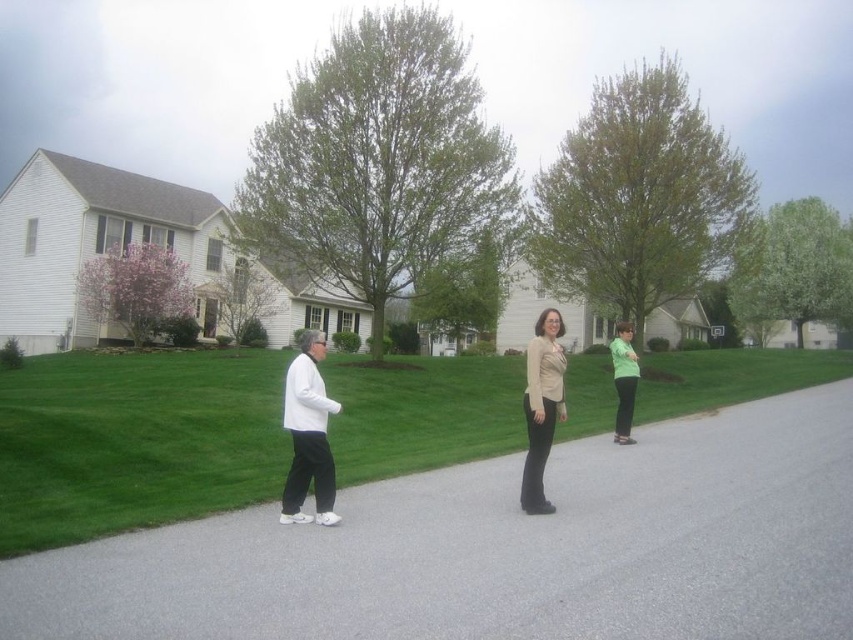
You are a photographer setting up a tripod on the paved path in the suburban scene. You want to position your camera so that both the white matte jacket at center and the matte green sweater at right are visible in the frame. Based on their positions, which direction should you aim the camera to ensure both are included?

The white matte jacket at center is to the left of the matte green sweater at right. To include both in the frame, aim the camera towards the right side of the path so that the leftward position of the white matte jacket at center and the rightward position of the matte green sweater at right are both captured within the camera view.

You are a drone operator trying to capture a photo of the white matte jacket at center and the green grass at center. Which object occupies a larger area in the image?

The green grass at center occupies a larger area in the image because its width is larger than that of the white matte jacket at center.